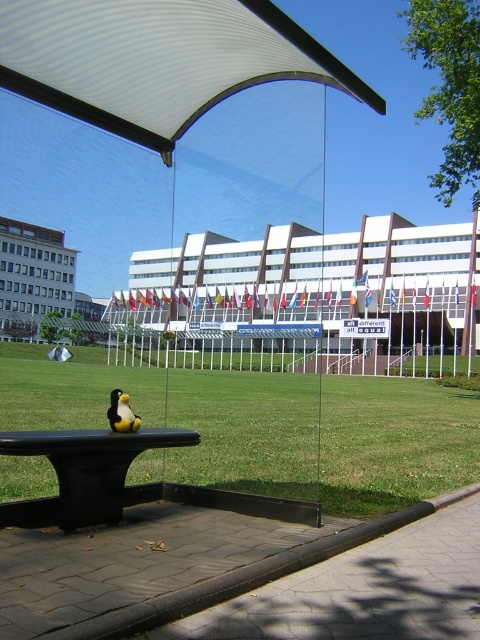
Question: Can you confirm if white fabric canopy at upper center is positioned to the left of yellow rubber duck at lower left?

Choices:
 (A) no
 (B) yes

Answer: (A)

Question: Which object appears closest to the camera in this image?

Choices:
 (A) white fabric canopy at upper center
 (B) yellow rubber duck at lower left
 (C) green grass at lower center
 (D) black matte park bench at center

Answer: (A)

Question: Which of the following is the closest to the observer?

Choices:
 (A) yellow rubber duck at lower left
 (B) green grass at lower center

Answer: (A)

Question: Is white fabric canopy at upper center to the left of yellow rubber duck at lower left from the viewer's perspective?

Choices:
 (A) no
 (B) yes

Answer: (A)

Question: Which point is closer to the camera?

Choices:
 (A) (94, 102)
 (B) (415, 477)

Answer: (A)

Question: Where is green grass at lower center located in relation to yellow rubber duck at lower left in the image?

Choices:
 (A) left
 (B) right

Answer: (B)